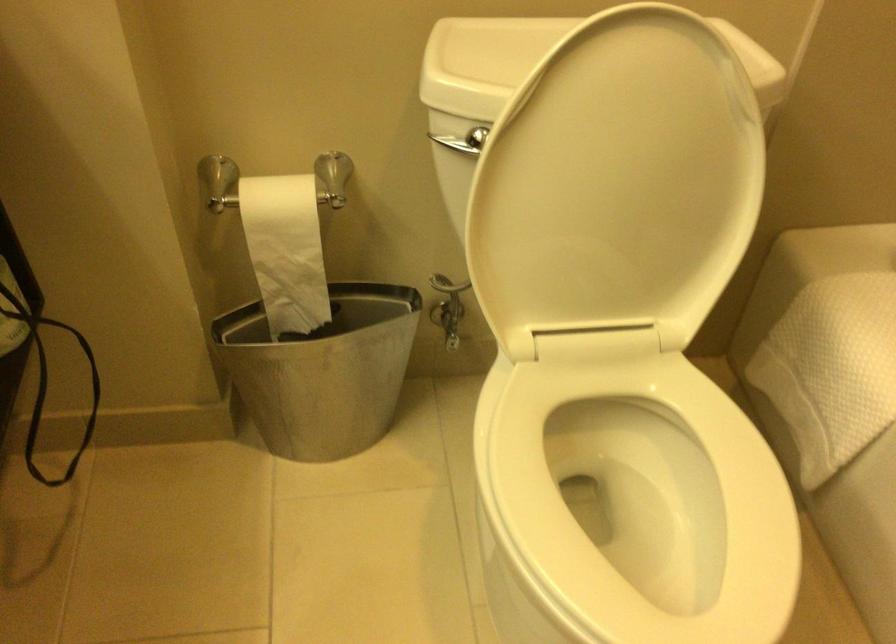
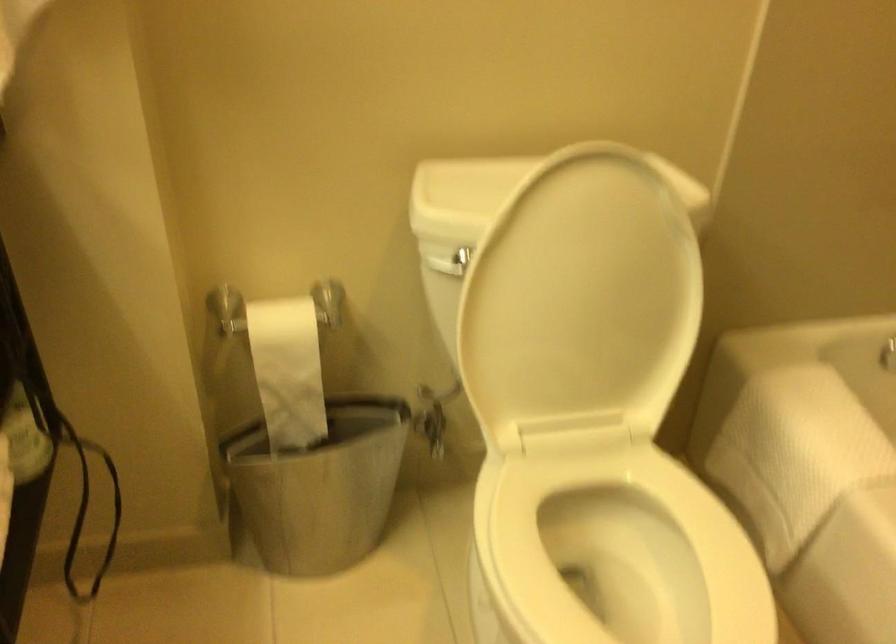
Locate, in the second image, the point that corresponds to pixel 319 375 in the first image.

(319, 487)